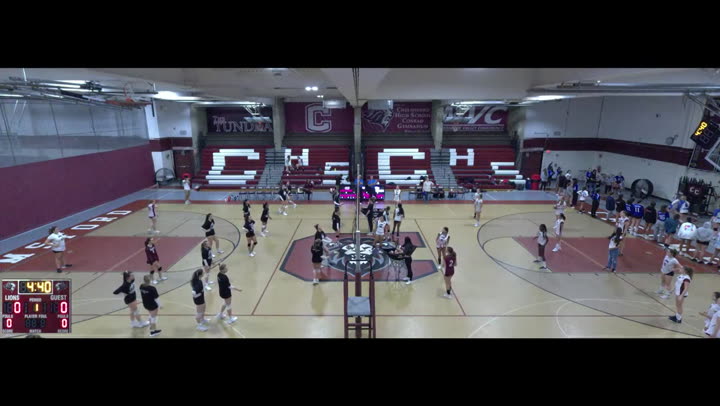
At what (x,y) coordinates should I click in order to perform the action: click on ceiling. Please return your answer as a coordinate pair (x, y). The width and height of the screenshot is (720, 406). Looking at the image, I should click on (410, 76).